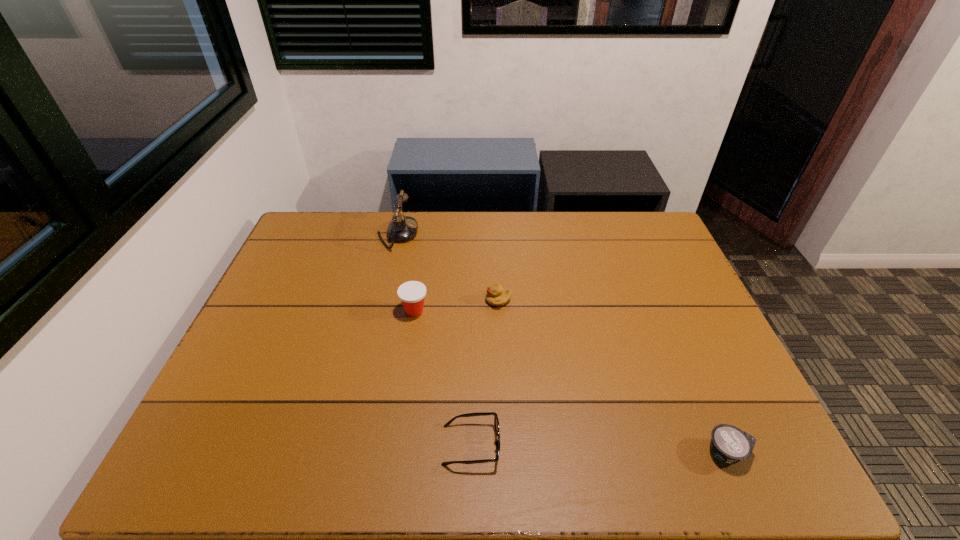
Image resolution: width=960 pixels, height=540 pixels. I want to click on free spot located at the beak of the third tallest object, so click(x=396, y=300).

Locate an element on the screen. The width and height of the screenshot is (960, 540). free region located on the back of the rightmost object is located at coordinates (684, 351).

Identify the location of vacant region located 0.110m on the lenses of the spectacles. (549, 444).

Where is `object that is positioned at the far edge`? The height and width of the screenshot is (540, 960). object that is positioned at the far edge is located at coordinates (401, 229).

Where is `yogurt present at the near edge`? The width and height of the screenshot is (960, 540). yogurt present at the near edge is located at coordinates (729, 444).

Locate an element on the screen. This screenshot has width=960, height=540. spectacles situated at the near edge is located at coordinates (496, 422).

The width and height of the screenshot is (960, 540). Find the location of `object that is positioned at the right edge`. object that is positioned at the right edge is located at coordinates (729, 444).

You are a GUI agent. You are given a task and a screenshot of the screen. Output one action in this format:
    pyautogui.click(x=<x>, y=<y>)
    Task: Click on the object located in the near right corner section of the desktop
    Image resolution: width=960 pixels, height=540 pixels.
    Given the screenshot: What is the action you would take?
    tap(729, 444)

I want to click on vacant space at the far edge, so click(481, 241).

Image resolution: width=960 pixels, height=540 pixels. In order to click on vacant position at the near edge of the desktop in this screenshot , I will do `click(490, 458)`.